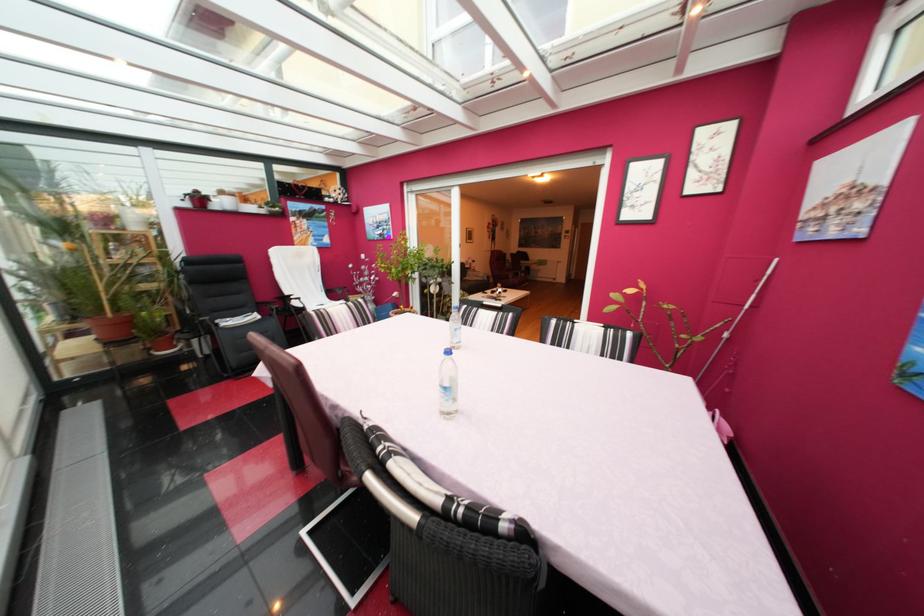
Find where to rest the white chair armrest. Please return your answer as a coordinate pair (x, y).

(293, 304)